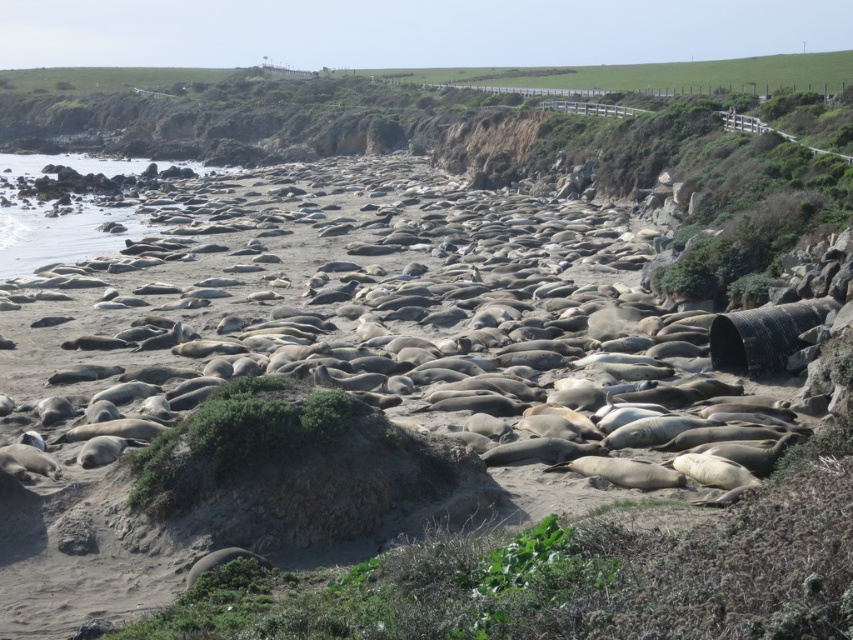
Question: Can you confirm if gray matte seal at center is positioned above gray matte seal at lower left?

Choices:
 (A) no
 (B) yes

Answer: (B)

Question: Is gray matte seal at center thinner than gray matte seal at lower left?

Choices:
 (A) no
 (B) yes

Answer: (A)

Question: Which point is closer to the camera taking this photo?

Choices:
 (A) (259, 557)
 (B) (624, 230)

Answer: (A)

Question: Which object appears farthest from the camera in this image?

Choices:
 (A) gray matte seal at lower left
 (B) gray matte seal at center

Answer: (A)

Question: Does gray matte seal at center have a greater width compared to gray matte seal at lower left?

Choices:
 (A) yes
 (B) no

Answer: (A)

Question: Which point appears closest to the camera in this image?

Choices:
 (A) (189, 586)
 (B) (338, 316)

Answer: (A)